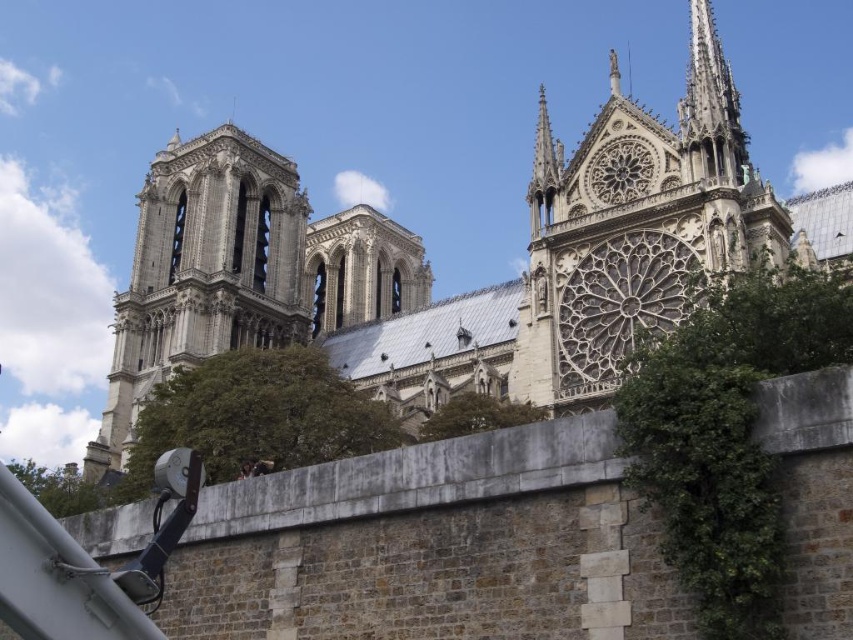
You are standing at the entrance of the cathedral and notice a point marked at coordinates (634, 227). What architectural feature does this point correspond to?

The point at coordinates (634, 227) corresponds to the white stone rose window at upper right.

You are a maintenance worker needing to reach both the white stone rose window at upper right and the smooth stone spire at upper right. The ladder you have is 15 feet long. Can you safely reach both objects with this ladder?

The white stone rose window at upper right is 14.44 feet from the smooth stone spire at upper right. Since the ladder is 15 feet long, which is longer than the distance between them, you can safely reach both objects with this ladder.